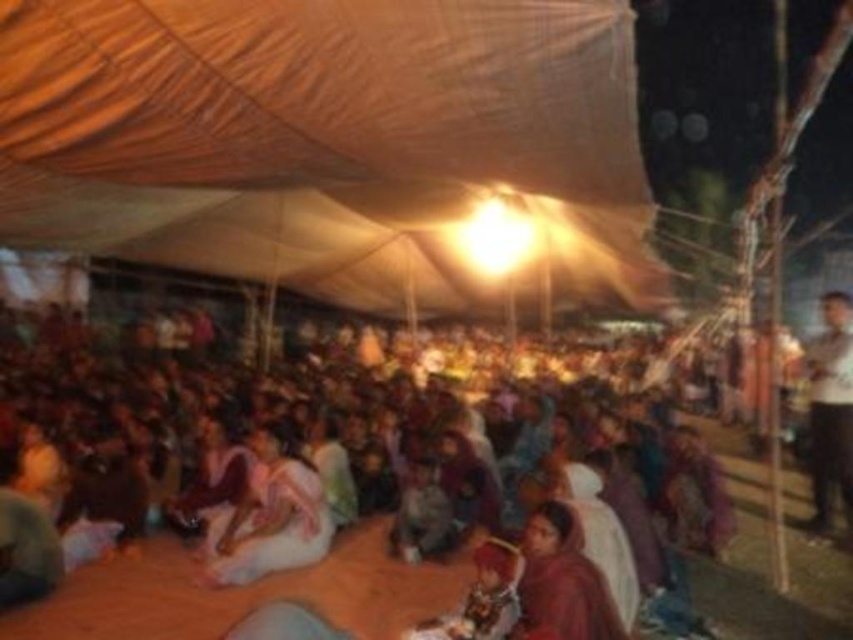
The height and width of the screenshot is (640, 853). What do you see at coordinates (328, 140) in the screenshot?
I see `beige fabric tent at center` at bounding box center [328, 140].

Can you confirm if beige fabric tent at center is positioned below white shirt at upper right?

No, beige fabric tent at center is not below white shirt at upper right.

Is point (590, 166) closer to camera compared to point (825, 328)?

That is True.

The height and width of the screenshot is (640, 853). Identify the location of beige fabric tent at center. pos(328,140).

Who is lower down, pink fabric at center or maroon fabric dress at center?

Positioned lower is pink fabric at center.

Is point (247, 556) closer to viewer compared to point (590, 584)?

No, (247, 556) is behind (590, 584).

Find the location of a particular element. pink fabric at center is located at coordinates (270, 516).

Between maroon fabric dress at center and white shirt at upper right, which one has more height?

white shirt at upper right is taller.

Is point (570, 614) closer to viewer compared to point (828, 522)?

Yes, point (570, 614) is closer to viewer.

The height and width of the screenshot is (640, 853). What do you see at coordinates (561, 582) in the screenshot? I see `maroon fabric dress at center` at bounding box center [561, 582].

The width and height of the screenshot is (853, 640). I want to click on maroon fabric dress at center, so click(561, 582).